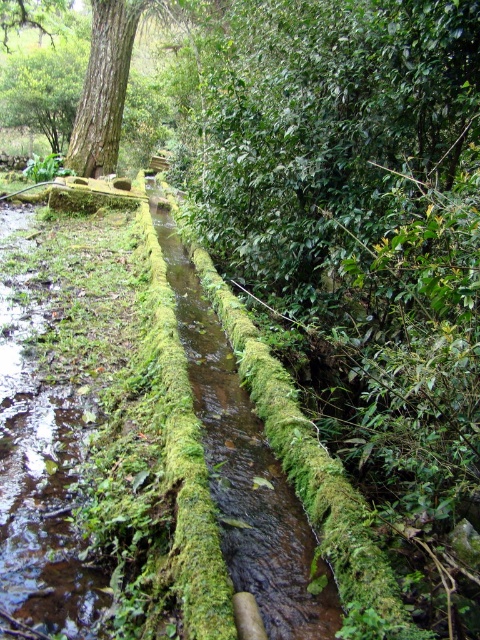
You are a hiker who wants to cross the canal using a 1.5 meter long plank. The green mossy water at center is in the middle of the canal. Can the plank reach from the brown rough tree trunk at upper left to the opposite bank?

The green mossy water at center has a smaller size compared to brown rough tree trunk at upper left. Since the tree trunk is larger, it is likely positioned farther away from the opposite bank. The 1.5 meter plank may not be long enough to span the distance between the brown rough tree trunk at upper left and the opposite bank.

You are standing at the point labeled point (115, 84) and want to walk towards the point labeled point (43, 625). Which direction should you face to move directly towards your destination?

You should face forward because point (43, 625) is in front of point (115, 84).

You are a hiker who wants to cross the green mossy water at center using the brown rough tree trunk at upper left as a bridge. Can you safely step on the water?

The green mossy water at center is thinner than the brown rough tree trunk at upper left, so the water is not thick enough to support your weight. It is not safe to step on the water.